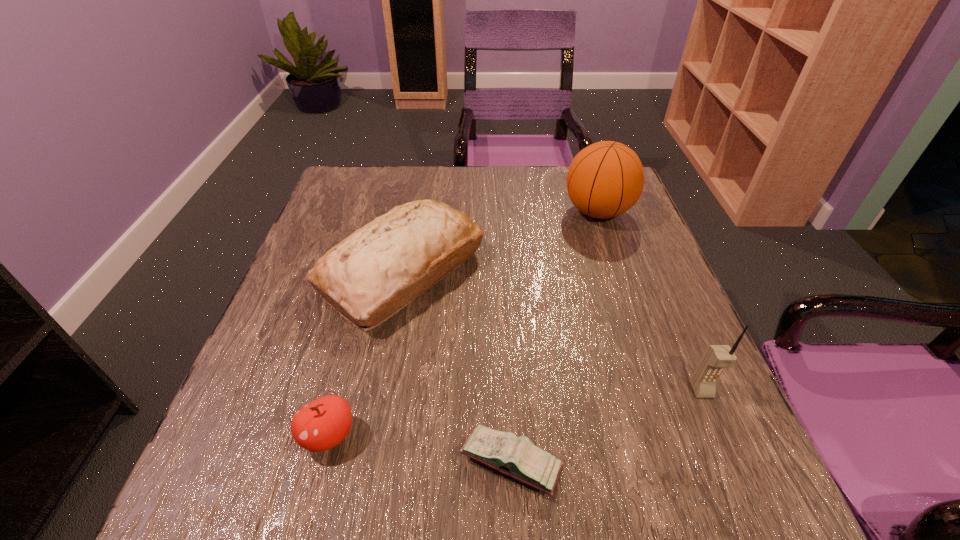
Where is `object that is at the far edge`? This screenshot has width=960, height=540. object that is at the far edge is located at coordinates (605, 179).

You are a GUI agent. You are given a task and a screenshot of the screen. Output one action in this format:
    pyautogui.click(x=<x>, y=<y>)
    Task: Click on the object present at the near edge
    This screenshot has height=540, width=960.
    Given the screenshot: What is the action you would take?
    pyautogui.click(x=517, y=457)

Locate an element on the screen. The width and height of the screenshot is (960, 540). bread that is at the left edge is located at coordinates (376, 271).

Find the location of a particular element. This screenshot has width=960, height=540. apple that is at the left edge is located at coordinates (322, 424).

Locate an element on the screen. This screenshot has width=960, height=540. basketball present at the right edge is located at coordinates (605, 179).

At what (x,y) coordinates should I click in order to perform the action: click on cellular telephone that is at the right edge. Please return your answer as a coordinate pair (x, y). Image resolution: width=960 pixels, height=540 pixels. Looking at the image, I should click on (716, 358).

You are a GUI agent. You are given a task and a screenshot of the screen. Output one action in this format:
    pyautogui.click(x=<x>, y=<y>)
    Task: Click on the object positioned at the far right corner
    The image size is (960, 540).
    Given the screenshot: What is the action you would take?
    pyautogui.click(x=605, y=179)

Find the location of a particular element. The height and width of the screenshot is (540, 960). vacant space at the far edge is located at coordinates (552, 176).

Where is `free space at the left edge`? This screenshot has height=540, width=960. free space at the left edge is located at coordinates (282, 310).

Identify the location of vacant area at the right edge of the desktop. (639, 217).